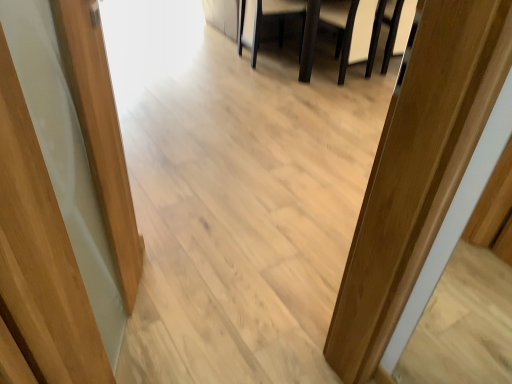
Question: From a real-world perspective, is white leather armchair at upper center, which ranks as the second armchair in left-to-right order, positioned above or below dark brown wooden table at center?

Choices:
 (A) below
 (B) above

Answer: (B)

Question: Does point (354, 23) appear closer or farther from the camera than point (304, 34)?

Choices:
 (A) farther
 (B) closer

Answer: (B)

Question: Which object is the farthest from the dark brown wooden table at center?

Choices:
 (A) dark brown leather armchair at center, the first armchair in the left-to-right sequence
 (B) white leather armchair at upper center, which ranks as the second armchair in left-to-right order

Answer: (A)

Question: Which object is the closest to the dark brown wooden table at center?

Choices:
 (A) dark brown leather armchair at center, the first armchair in the left-to-right sequence
 (B) white leather armchair at upper center, which ranks as the second armchair in left-to-right order

Answer: (B)